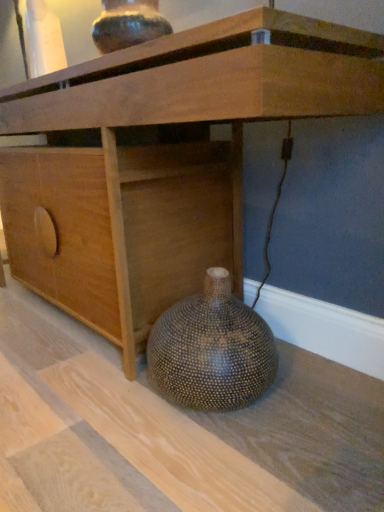
The width and height of the screenshot is (384, 512). What are the coordinates of `speckled ceramic vase at upper center, which is the first vase from top to bottom` in the screenshot? It's located at pyautogui.click(x=128, y=24).

What are the coordinates of `speckled ceramic vase at upper center, which is the first vase from top to bottom` in the screenshot? It's located at (128, 24).

Does point (116, 31) come farther from viewer compared to point (353, 108)?

Yes, it is behind point (353, 108).

Is speckled ceramic vase at upper center, which is the first vase from top to bottom, turned away from wooden cabinet at lower center?

speckled ceramic vase at upper center, which is the first vase from top to bottom, is not turned away from wooden cabinet at lower center.

Does speckled ceramic vase at upper center, the 2th vase when ordered from bottom to top, appear on the left side of wooden cabinet at lower center?

Incorrect, speckled ceramic vase at upper center, the 2th vase when ordered from bottom to top, is not on the left side of wooden cabinet at lower center.

In terms of width, does speckled ceramic vase at upper center, the 2th vase when ordered from bottom to top, look wider or thinner when compared to wooden cabinet at lower center?

Considering their sizes, speckled ceramic vase at upper center, the 2th vase when ordered from bottom to top, looks slimmer than wooden cabinet at lower center.

From the image's perspective, which is below, brown textured vase at lower right, which ranks as the 2th vase in top-to-bottom order, or wooden cabinet at lower center?

brown textured vase at lower right, which ranks as the 2th vase in top-to-bottom order, from the image's perspective.

Where is `vase below the wooden cabinet at lower center (from a real-world perspective)`? vase below the wooden cabinet at lower center (from a real-world perspective) is located at coordinates (211, 350).

Considering the relative sizes of brown textured vase at lower right, the 1th vase in the bottom-to-top sequence, and wooden cabinet at lower center in the image provided, is brown textured vase at lower right, the 1th vase in the bottom-to-top sequence, smaller than wooden cabinet at lower center?

Indeed, brown textured vase at lower right, the 1th vase in the bottom-to-top sequence, has a smaller size compared to wooden cabinet at lower center.

Is brown textured vase at lower right, which ranks as the 2th vase in top-to-bottom order, taller than wooden cabinet at lower center?

No, brown textured vase at lower right, which ranks as the 2th vase in top-to-bottom order, is not taller than wooden cabinet at lower center.

How many degrees apart are the facing directions of wooden cabinet at lower center and brown textured vase at lower right, the 1th vase in the bottom-to-top sequence?

The angle between the facing direction of wooden cabinet at lower center and the facing direction of brown textured vase at lower right, the 1th vase in the bottom-to-top sequence, is 2.29 degrees.

Locate an element on the screen. The width and height of the screenshot is (384, 512). vase below the wooden cabinet at lower center (from a real-world perspective) is located at coordinates (211, 350).

Measure the distance between wooden cabinet at lower center and brown textured vase at lower right, the 1th vase in the bottom-to-top sequence.

The distance of wooden cabinet at lower center from brown textured vase at lower right, the 1th vase in the bottom-to-top sequence, is 55.82 centimeters.

Looking at their sizes, would you say wooden cabinet at lower center is wider or thinner than brown textured vase at lower right, the 1th vase in the bottom-to-top sequence?

Considering their sizes, wooden cabinet at lower center looks broader than brown textured vase at lower right, the 1th vase in the bottom-to-top sequence.

Which is closer to the camera, (x=295, y=55) or (x=140, y=42)?

Point (x=295, y=55)

From a real-world perspective, is wooden cabinet at lower center above or below speckled ceramic vase at upper center, which is the first vase from top to bottom?

wooden cabinet at lower center is situated lower than speckled ceramic vase at upper center, which is the first vase from top to bottom, in the real world.

Considering the sizes of objects wooden cabinet at lower center and speckled ceramic vase at upper center, which is the first vase from top to bottom, in the image provided, who is bigger, wooden cabinet at lower center or speckled ceramic vase at upper center, which is the first vase from top to bottom,?

wooden cabinet at lower center.

Does speckled ceramic vase at upper center, which is the first vase from top to bottom, have a greater width compared to brown textured vase at lower right, which ranks as the 2th vase in top-to-bottom order?

No.

From the image's perspective, is speckled ceramic vase at upper center, the 2th vase when ordered from bottom to top, located above brown textured vase at lower right, the 1th vase in the bottom-to-top sequence?

Indeed, from the image's perspective, speckled ceramic vase at upper center, the 2th vase when ordered from bottom to top, is shown above brown textured vase at lower right, the 1th vase in the bottom-to-top sequence.

Which of these two, speckled ceramic vase at upper center, the 2th vase when ordered from bottom to top, or brown textured vase at lower right, which ranks as the 2th vase in top-to-bottom order, is smaller?

speckled ceramic vase at upper center, the 2th vase when ordered from bottom to top, is smaller.

Can we say speckled ceramic vase at upper center, the 2th vase when ordered from bottom to top, lies outside brown textured vase at lower right, which ranks as the 2th vase in top-to-bottom order?

Yes, speckled ceramic vase at upper center, the 2th vase when ordered from bottom to top, is outside of brown textured vase at lower right, which ranks as the 2th vase in top-to-bottom order.

How far apart are brown textured vase at lower right, the 1th vase in the bottom-to-top sequence, and speckled ceramic vase at upper center, the 2th vase when ordered from bottom to top?

brown textured vase at lower right, the 1th vase in the bottom-to-top sequence, is 78.31 centimeters away from speckled ceramic vase at upper center, the 2th vase when ordered from bottom to top.

How many degrees apart are the facing directions of brown textured vase at lower right, the 1th vase in the bottom-to-top sequence, and speckled ceramic vase at upper center, the 2th vase when ordered from bottom to top?

The angle between the facing direction of brown textured vase at lower right, the 1th vase in the bottom-to-top sequence, and the facing direction of speckled ceramic vase at upper center, the 2th vase when ordered from bottom to top, is 4.89 degrees.

From the image's perspective, between brown textured vase at lower right, which ranks as the 2th vase in top-to-bottom order, and speckled ceramic vase at upper center, which is the first vase from top to bottom, which one is located above?

speckled ceramic vase at upper center, which is the first vase from top to bottom, from the image's perspective.

From a real-world perspective, between brown textured vase at lower right, the 1th vase in the bottom-to-top sequence, and speckled ceramic vase at upper center, which is the first vase from top to bottom, who is vertically lower?

brown textured vase at lower right, the 1th vase in the bottom-to-top sequence, is physically lower.

Find the location of a particular element. This screenshot has width=384, height=512. table in front of the speckled ceramic vase at upper center, which is the first vase from top to bottom is located at coordinates (122, 58).

This screenshot has width=384, height=512. I want to click on table above the brown textured vase at lower right, the 1th vase in the bottom-to-top sequence (from the image's perspective), so (122, 58).

When comparing their distances from wooden cabinet at lower center, does speckled ceramic vase at upper center, which is the first vase from top to bottom, or brown textured vase at lower right, which ranks as the 2th vase in top-to-bottom order, seem closer?

The object closer to wooden cabinet at lower center is speckled ceramic vase at upper center, which is the first vase from top to bottom.

Based on their spatial positions, is speckled ceramic vase at upper center, the 2th vase when ordered from bottom to top, or wooden cabinet at lower center further from brown textured vase at lower right, the 1th vase in the bottom-to-top sequence?

The object further to brown textured vase at lower right, the 1th vase in the bottom-to-top sequence, is speckled ceramic vase at upper center, the 2th vase when ordered from bottom to top.

When comparing their distances from speckled ceramic vase at upper center, which is the first vase from top to bottom, does wooden cabinet at lower center or brown textured vase at lower right, which ranks as the 2th vase in top-to-bottom order, seem closer?

Among the two, wooden cabinet at lower center is located nearer to speckled ceramic vase at upper center, which is the first vase from top to bottom.

Based on their spatial positions, is brown textured vase at lower right, the 1th vase in the bottom-to-top sequence, or speckled ceramic vase at upper center, which is the first vase from top to bottom, further from wooden cabinet at lower center?

Answer: brown textured vase at lower right, the 1th vase in the bottom-to-top sequence, lies further to wooden cabinet at lower center than the other object.

From the image, which object appears to be farther from speckled ceramic vase at upper center, the 2th vase when ordered from bottom to top, brown textured vase at lower right, which ranks as the 2th vase in top-to-bottom order, or wooden cabinet at lower center?

brown textured vase at lower right, which ranks as the 2th vase in top-to-bottom order, is further to speckled ceramic vase at upper center, the 2th vase when ordered from bottom to top.

Considering their positions, is wooden cabinet at lower center positioned further to brown textured vase at lower right, which ranks as the 2th vase in top-to-bottom order, than speckled ceramic vase at upper center, the 2th vase when ordered from bottom to top?

The object further to brown textured vase at lower right, which ranks as the 2th vase in top-to-bottom order, is speckled ceramic vase at upper center, the 2th vase when ordered from bottom to top.

Image resolution: width=384 pixels, height=512 pixels. Identify the location of table between speckled ceramic vase at upper center, the 2th vase when ordered from bottom to top, and brown textured vase at lower right, the 1th vase in the bottom-to-top sequence, in the vertical direction. coord(122,58).